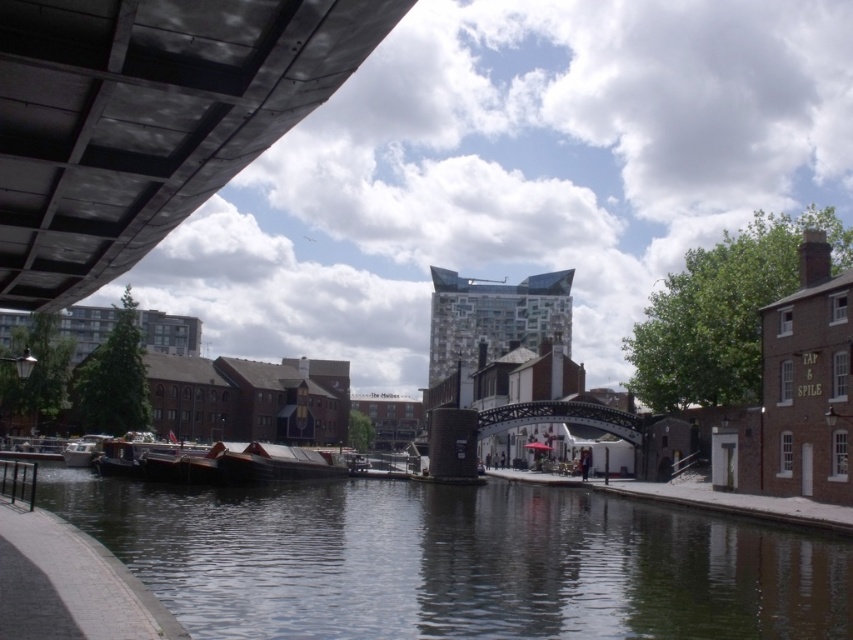
Who is more forward, (664, 618) or (244, 467)?

Point (664, 618) is more forward.

Between dark water at center and wooden boat at center, which one has more height?

With more height is wooden boat at center.

Does point (509, 624) come farther from viewer compared to point (236, 477)?

No, it is in front of (236, 477).

Locate an element on the screen. The width and height of the screenshot is (853, 640). dark water at center is located at coordinates (456, 561).